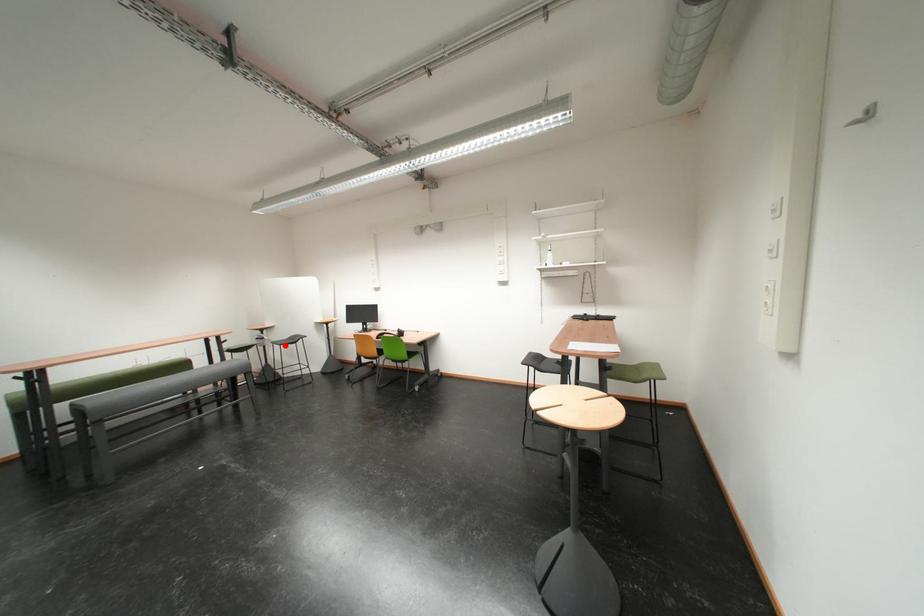
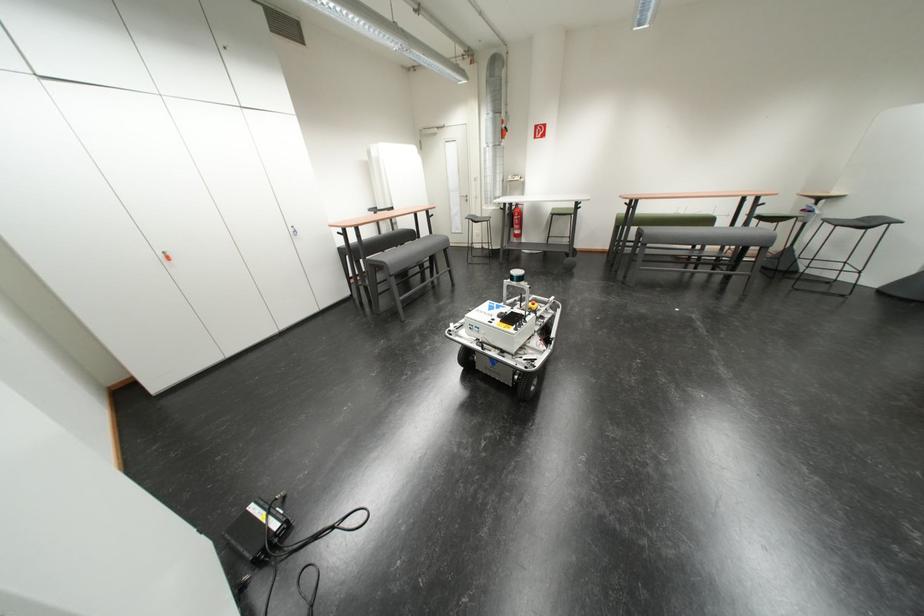
Where in the second image is the point corresponding to the highlighted location from the first image?

(837, 223)